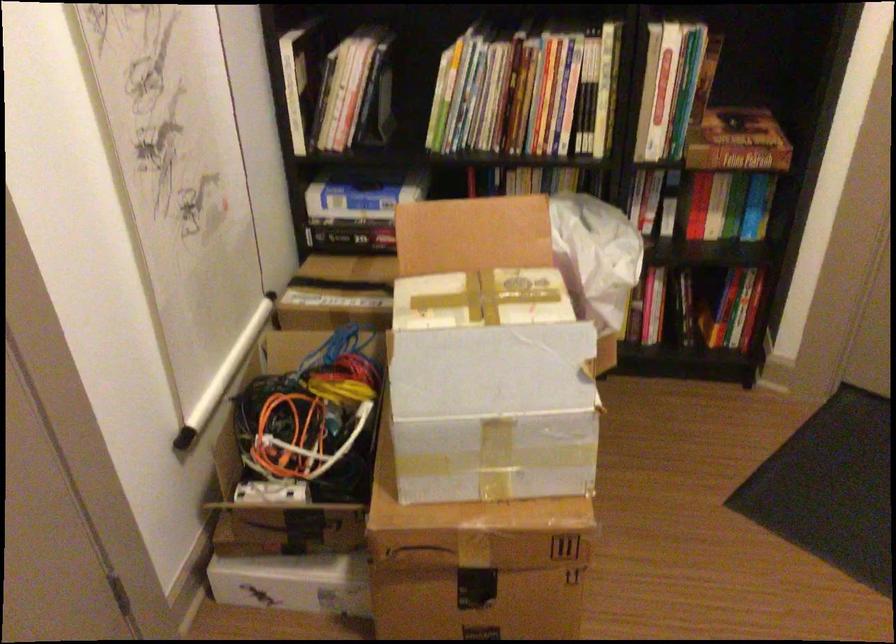
You are a GUI agent. You are given a task and a screenshot of the screen. Output one action in this format:
    pyautogui.click(x=<x>, y=<y>)
    Task: Click on the white box
    The image size is (896, 644).
    Given the screenshot: What is the action you would take?
    pyautogui.click(x=293, y=583)